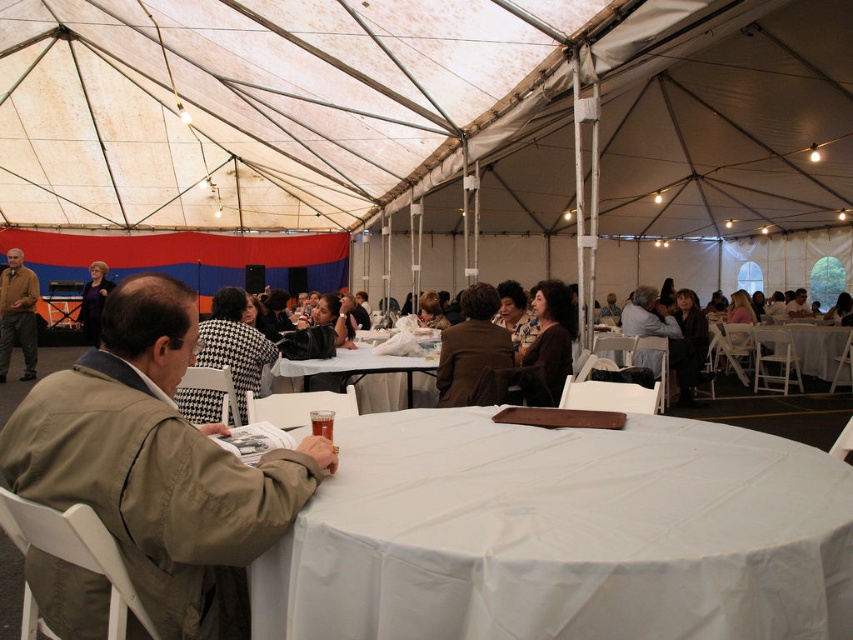
Is tan fabric jacket at left smaller than brown leather jacket at center?

Correct, tan fabric jacket at left occupies less space than brown leather jacket at center.

Looking at this image, is tan fabric jacket at left above brown leather jacket at center?

No.

Locate an element on the screen. tan fabric jacket at left is located at coordinates (157, 465).

Is white plastic table at center below brown leather jacket at center?

Yes, white plastic table at center is below brown leather jacket at center.

Which is more to the left, white plastic table at center or brown leather jacket at center?

From the viewer's perspective, white plastic table at center appears more on the left side.

Measure the distance between white plastic table at center and camera.

They are 4.63 meters apart.

Where is `white plastic table at center`? white plastic table at center is located at coordinates (368, 378).

Measure the distance between white cloth at center and camera.

The distance of white cloth at center from camera is 3.91 feet.

You are a GUI agent. You are given a task and a screenshot of the screen. Output one action in this format:
    pyautogui.click(x=<x>, y=<y>)
    Task: Click on the white cloth at center
    
    Given the screenshot: What is the action you would take?
    pyautogui.click(x=561, y=534)